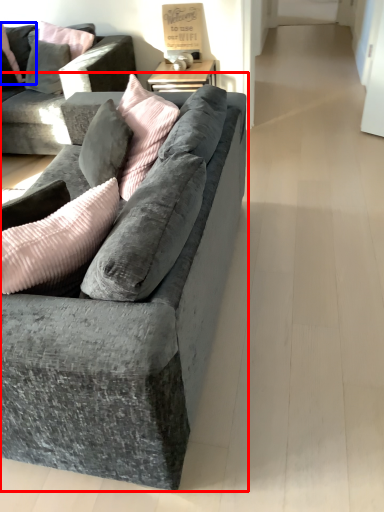
Question: Which object appears farthest to the camera in this image, studio couch (highlighted by a red box) or pillow (highlighted by a blue box)?

Choices:
 (A) studio couch
 (B) pillow

Answer: (B)